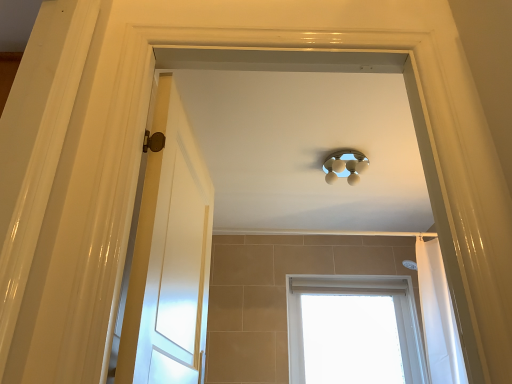
Question: Can you confirm if white wooden door at left is wider than satin silver light fixture at center?

Choices:
 (A) no
 (B) yes

Answer: (A)

Question: Is satin silver light fixture at center surrounded by white wooden door at left?

Choices:
 (A) no
 (B) yes

Answer: (A)

Question: From a real-world perspective, is white wooden door at left beneath satin silver light fixture at center?

Choices:
 (A) no
 (B) yes

Answer: (B)

Question: Does white wooden door at left have a larger size compared to satin silver light fixture at center?

Choices:
 (A) yes
 (B) no

Answer: (A)

Question: From the image's perspective, is white wooden door at left below satin silver light fixture at center?

Choices:
 (A) no
 (B) yes

Answer: (B)

Question: Does white wooden door at left turn towards satin silver light fixture at center?

Choices:
 (A) yes
 (B) no

Answer: (B)

Question: Is white wooden door at left shorter than white plastic window at lower center?

Choices:
 (A) no
 (B) yes

Answer: (A)

Question: From a real-world perspective, is white wooden door at left on white plastic window at lower center?

Choices:
 (A) yes
 (B) no

Answer: (B)

Question: Is white wooden door at left with white plastic window at lower center?

Choices:
 (A) no
 (B) yes

Answer: (A)

Question: Is white wooden door at left thinner than white plastic window at lower center?

Choices:
 (A) yes
 (B) no

Answer: (A)

Question: From a real-world perspective, is white wooden door at left under white plastic window at lower center?

Choices:
 (A) no
 (B) yes

Answer: (B)

Question: Is white wooden door at left smaller than white plastic window at lower center?

Choices:
 (A) no
 (B) yes

Answer: (B)

Question: Does white fabric shower curtain at right have a smaller size compared to white wooden door at left?

Choices:
 (A) no
 (B) yes

Answer: (A)